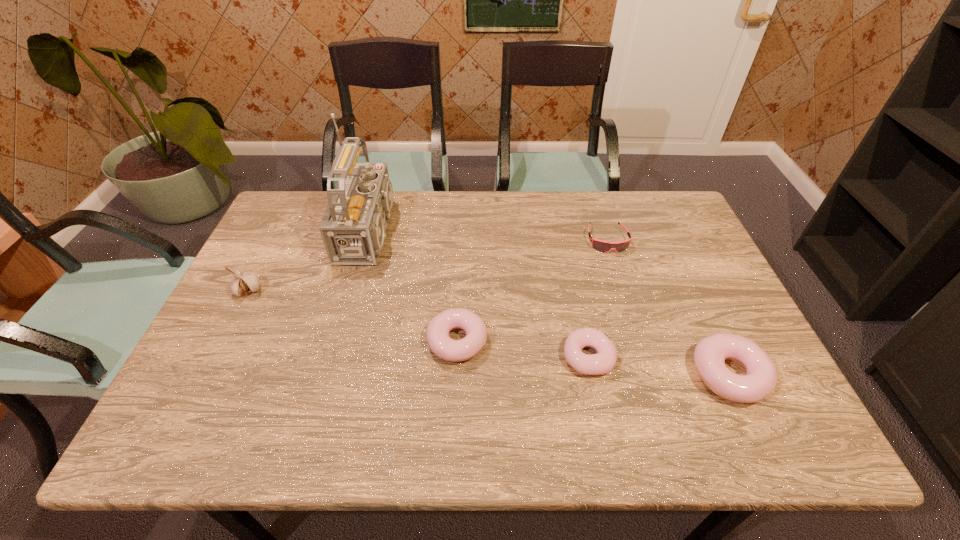
At what (x,y) coordinates should I click in order to perform the action: click on object at the near right corner. Please return your answer as a coordinate pair (x, y). This screenshot has width=960, height=540. Looking at the image, I should click on (760, 379).

In the image, there is a desktop. Where is `free space at the far edge`? free space at the far edge is located at coordinates (542, 210).

You are a GUI agent. You are given a task and a screenshot of the screen. Output one action in this format:
    pyautogui.click(x=<x>, y=<y>)
    Task: Click on the free space at the near edge of the desktop
    
    Given the screenshot: What is the action you would take?
    coord(402,384)

Find the location of a particular element. This screenshot has width=960, height=540. vacant space at the left edge of the desktop is located at coordinates (238, 302).

The height and width of the screenshot is (540, 960). I want to click on vacant space at the right edge of the desktop, so click(x=686, y=338).

At what (x,y) coordinates should I click in order to perform the action: click on vacant space at the far left corner. Please return your answer as a coordinate pair (x, y). The image size is (960, 540). Looking at the image, I should click on tap(307, 220).

Find the location of a particular element. vacant space at the far right corner is located at coordinates (660, 202).

At what (x,y) coordinates should I click in order to perform the action: click on unoccupied position between the rightmost object and the fourth nearest object. Please return your answer as a coordinate pair (x, y). The image size is (960, 540). Looking at the image, I should click on point(489,333).

Identify the location of empty space between the fifth object from right to left and the third farthest object. The height and width of the screenshot is (540, 960). (312, 261).

This screenshot has height=540, width=960. I want to click on free space between the fifth object from left to right and the radio receiver, so click(492, 236).